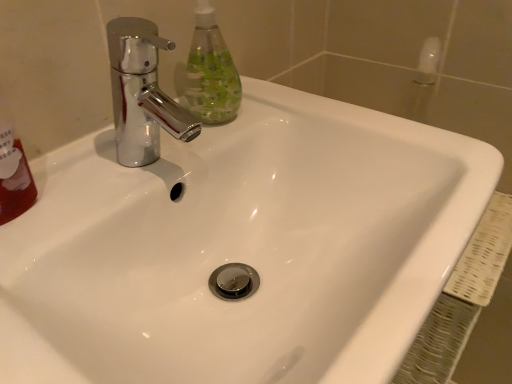
The height and width of the screenshot is (384, 512). I want to click on unoccupied area in front of chrome metallic faucet at upper left, so click(91, 239).